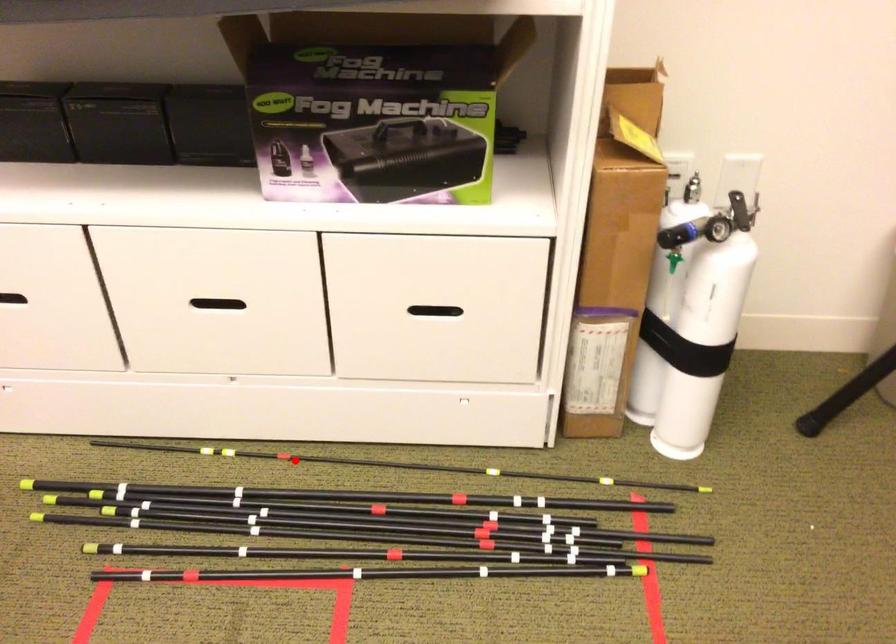
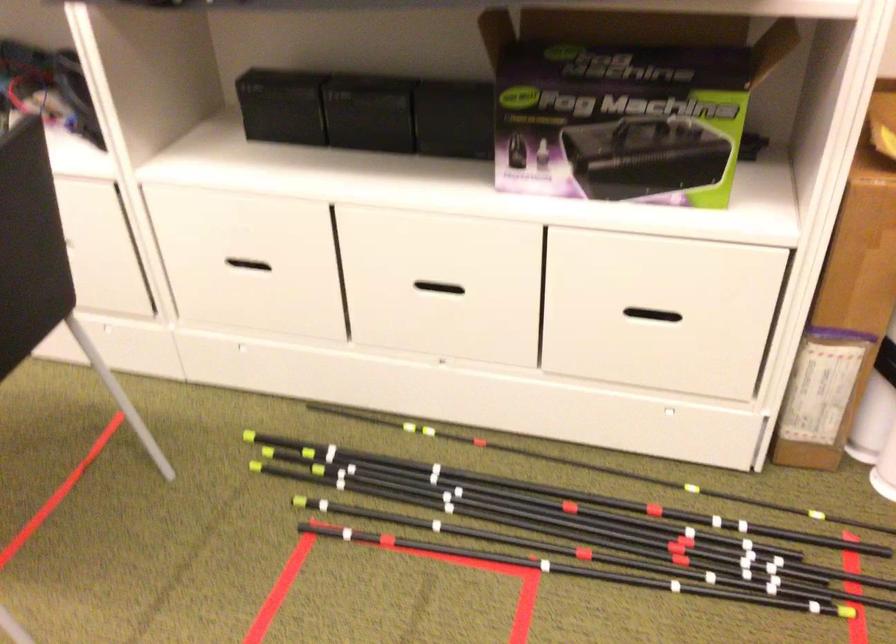
Find the pixel in the second image that matches the highlighted location in the first image.

(493, 448)